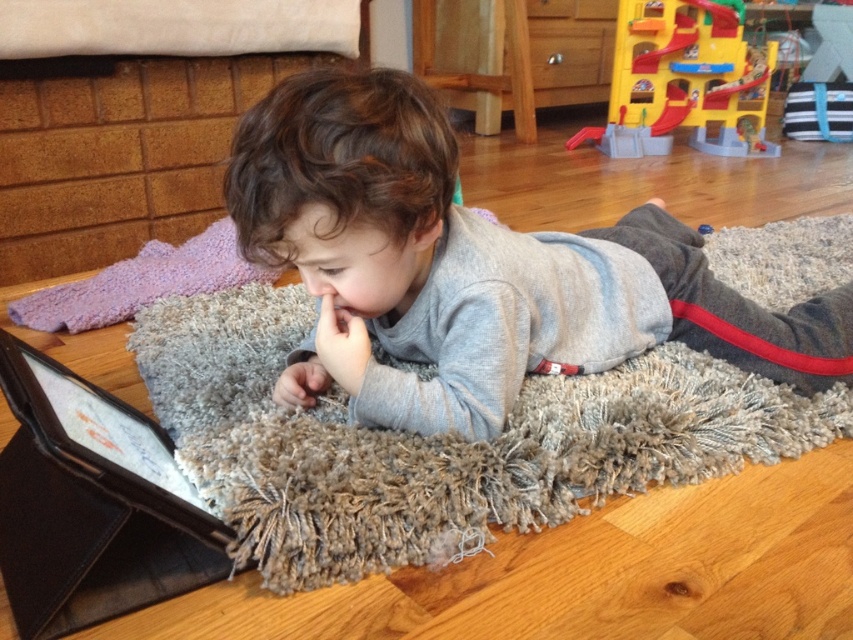
Question: Does gray soft fabric at center have a larger size compared to yellow plastic playset at upper right?

Choices:
 (A) yes
 (B) no

Answer: (B)

Question: Which point is farther from the camera taking this photo?

Choices:
 (A) (698, 100)
 (B) (419, 170)

Answer: (A)

Question: Does gray soft fabric at center have a larger size compared to yellow plastic playset at upper right?

Choices:
 (A) no
 (B) yes

Answer: (A)

Question: Is gray soft fabric at center further to the viewer compared to yellow plastic playset at upper right?

Choices:
 (A) no
 (B) yes

Answer: (A)